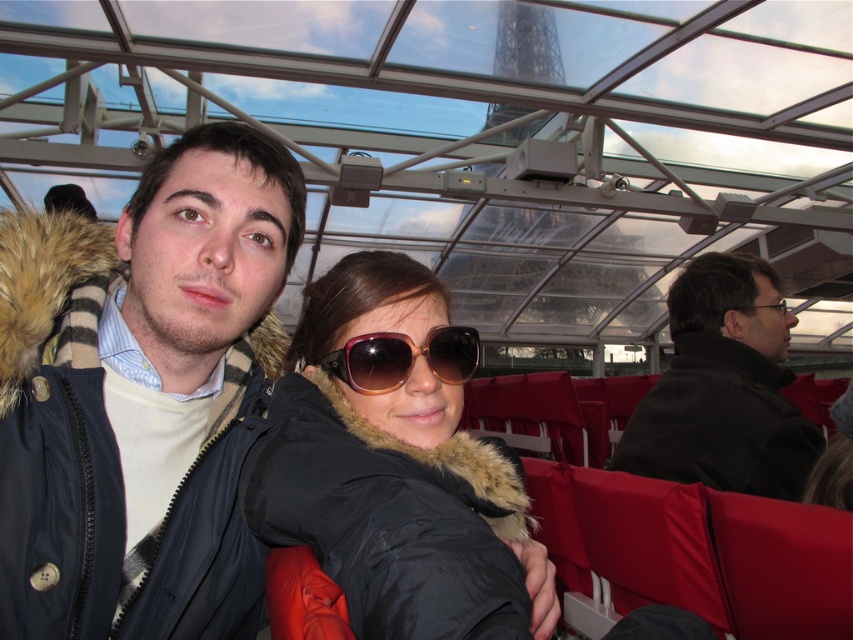
You are a photographer standing at the center of the observation deck. You want to take a photo of the dark brown leather jacket at right and the brown gradient plastic sunglasses at center. If your camera has a focal length of 50mm, which object should you focus on to ensure both are in sharp focus?

Since the dark brown leather jacket at right is only 1.01 meters away from the brown gradient plastic sunglasses at center, focusing on the brown gradient plastic sunglasses at center will keep both objects in sharp focus as they are within the acceptable focus range of a 50mm lens.

You are standing in the observation deck and want to take a photo of both the point at coordinates (77, 310) and the point at coordinates (328, 420). Which point should you focus on first to ensure both are in focus?

You should focus on the point at coordinates (77, 310) first because it is closer to you than the point at coordinates (328, 420). This way, adjusting the focus from near to far will help both points be in focus.